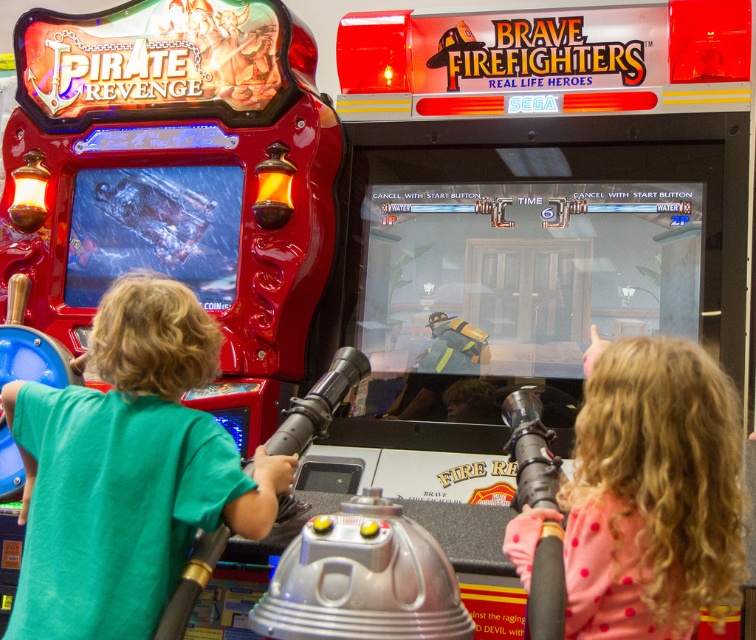
Question: Does green matte shirt at left appear under pink dotted shirt at right?

Choices:
 (A) no
 (B) yes

Answer: (A)

Question: Which point appears farthest from the camera in this image?

Choices:
 (A) pyautogui.click(x=668, y=573)
 (B) pyautogui.click(x=141, y=550)

Answer: (B)

Question: Can you confirm if green matte shirt at left is wider than pink dotted shirt at right?

Choices:
 (A) no
 (B) yes

Answer: (B)

Question: Does green matte shirt at left have a larger size compared to pink dotted shirt at right?

Choices:
 (A) no
 (B) yes

Answer: (A)